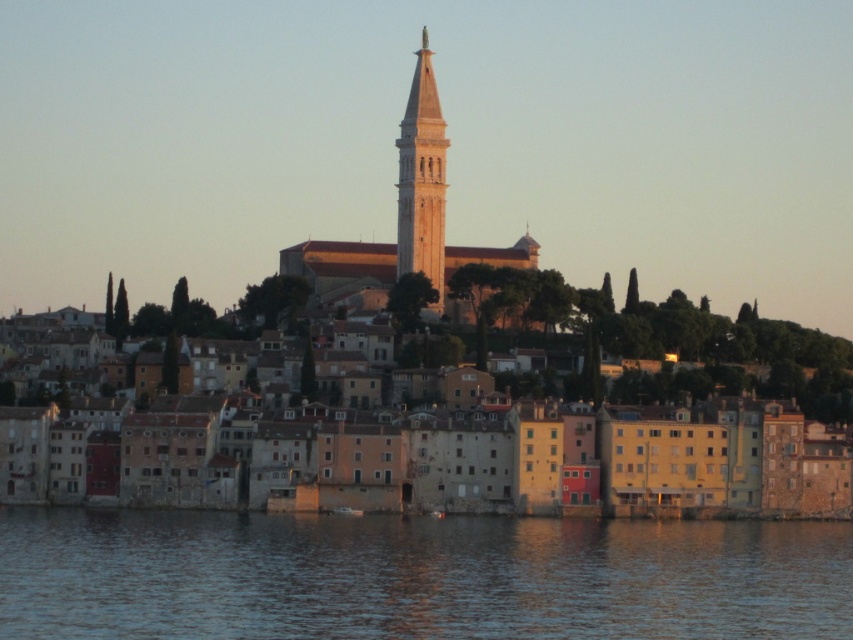
Question: Is blue water at lower center above light beige stone bell tower at center?

Choices:
 (A) no
 (B) yes

Answer: (A)

Question: Considering the real-world distances, which object is farthest from the light beige stone bell tower at center?

Choices:
 (A) stone buildings at center
 (B) blue water at lower center

Answer: (B)

Question: Based on their relative distances, which object is nearer to the light beige stone bell tower at center?

Choices:
 (A) stone buildings at center
 (B) blue water at lower center

Answer: (A)

Question: Can you confirm if blue water at lower center is positioned to the left of light beige stone bell tower at center?

Choices:
 (A) no
 (B) yes

Answer: (B)

Question: Which of these objects is positioned closest to the stone buildings at center?

Choices:
 (A) blue water at lower center
 (B) light beige stone bell tower at center

Answer: (B)

Question: Does blue water at lower center appear on the left side of light beige stone bell tower at center?

Choices:
 (A) yes
 (B) no

Answer: (A)